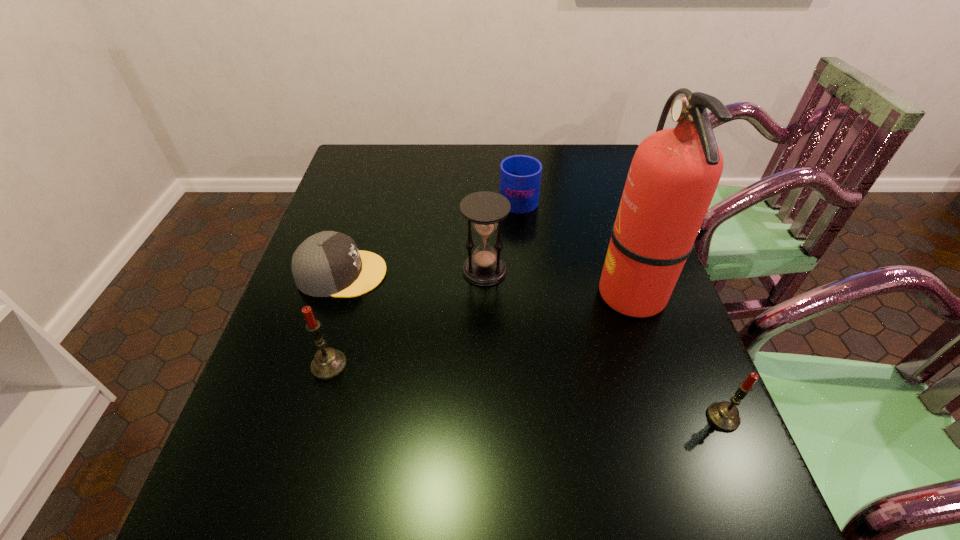
Where is `the farther candle`? This screenshot has width=960, height=540. the farther candle is located at coordinates click(328, 363).

Find the location of a particular element. The image size is (960, 540). the left candle is located at coordinates (328, 363).

This screenshot has width=960, height=540. In order to click on the fourth tallest object in this screenshot , I will do `click(724, 415)`.

This screenshot has height=540, width=960. What are the coordinates of `the shorter candle` in the screenshot? It's located at (724, 415).

This screenshot has width=960, height=540. Find the location of `the fifth tallest object`. the fifth tallest object is located at coordinates (520, 176).

The height and width of the screenshot is (540, 960). Find the location of `the farthest object`. the farthest object is located at coordinates (520, 176).

Find the location of a particular element. the tallest object is located at coordinates (674, 174).

Where is `cap`? The height and width of the screenshot is (540, 960). cap is located at coordinates (328, 263).

Identify the location of hourglass. The height and width of the screenshot is (540, 960). (486, 210).

At what (x,y) coordinates should I click in order to perform the action: click on free region located on the right of the left candle. Please return your answer as a coordinate pair (x, y). Image resolution: width=960 pixels, height=540 pixels. Looking at the image, I should click on (x=437, y=366).